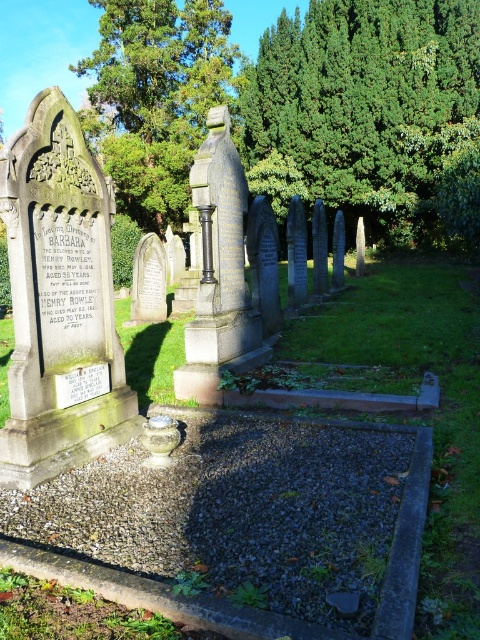
Does green leafy tree at upper center have a smaller size compared to green leafy tree at upper left?

Yes, green leafy tree at upper center is smaller than green leafy tree at upper left.

Does point (324, 131) lie in front of point (91, 120)?

Yes, point (324, 131) is in front of point (91, 120).

The width and height of the screenshot is (480, 640). What are the coordinates of `green leafy tree at upper center` in the screenshot? It's located at (376, 112).